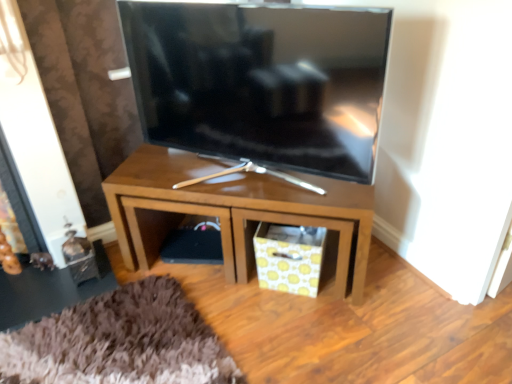
Where is `free space in front of wooden tv stand at center`? free space in front of wooden tv stand at center is located at coordinates (264, 332).